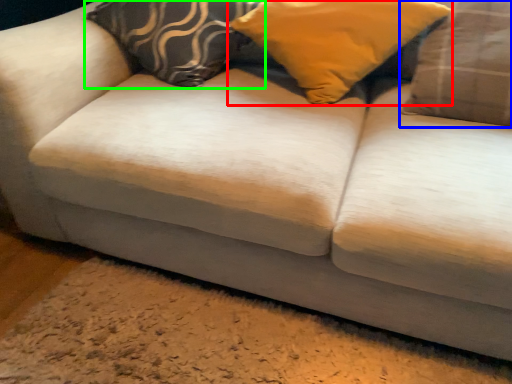
Question: Which object is the closest to the pillow (highlighted by a red box)? Choose among these: pillow (highlighted by a blue box) or pillow (highlighted by a green box).

Choices:
 (A) pillow
 (B) pillow

Answer: (A)